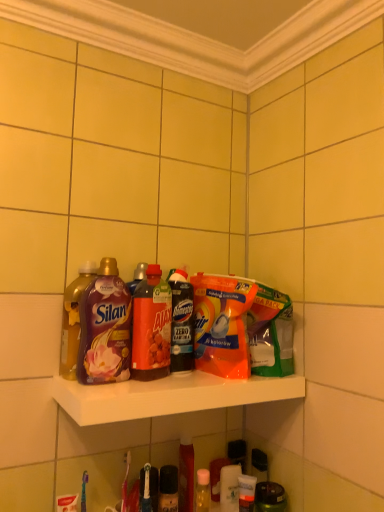
Find the location of `vacant space to the right of translucent orange bottle at center, the 2th bottle when ordered from right to left`. vacant space to the right of translucent orange bottle at center, the 2th bottle when ordered from right to left is located at coordinates pos(190,379).